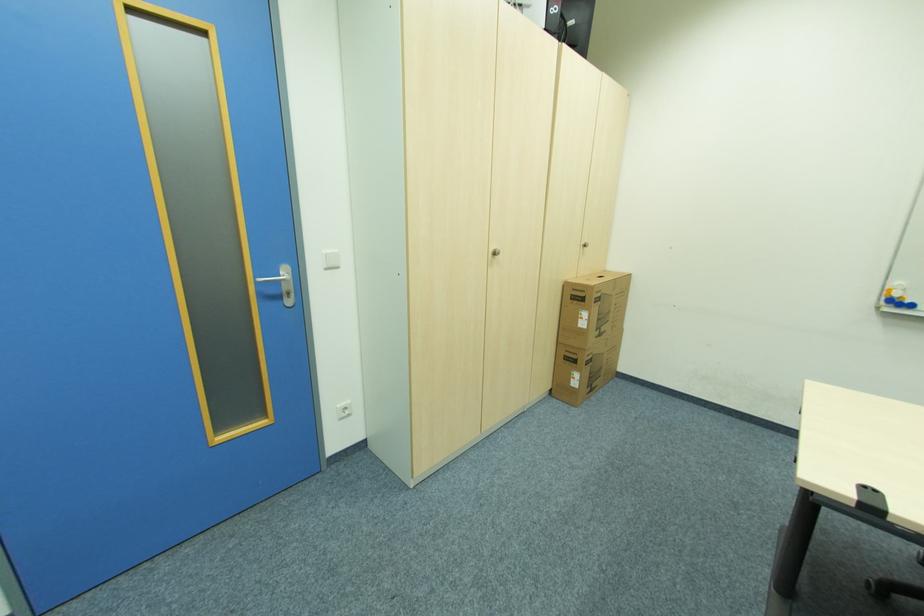
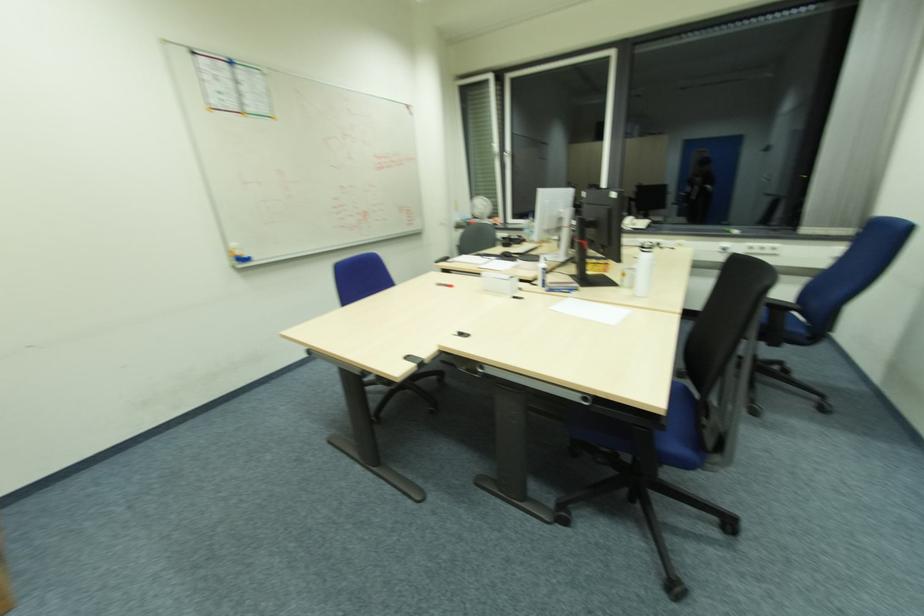
How did the camera likely rotate?

The camera's rotation is toward right-down.